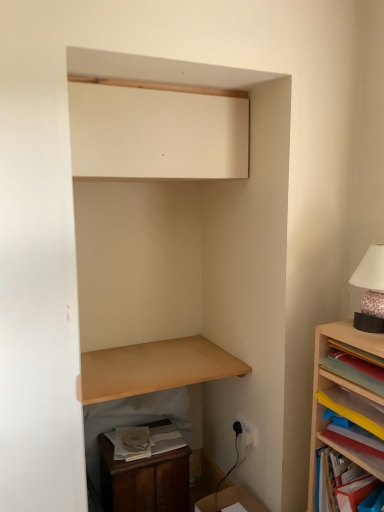
Question: In the image, is cardboard box at lower right positioned in front of or behind wooden dresser at lower left?

Choices:
 (A) front
 (B) behind

Answer: (A)

Question: Considering the positions of cardboard box at lower right and wooden dresser at lower left in the image, is cardboard box at lower right wider or thinner than wooden dresser at lower left?

Choices:
 (A) thin
 (B) wide

Answer: (A)

Question: Which of these objects is positioned farthest from the wooden dresser at lower left?

Choices:
 (A) cardboard box at lower right
 (B) wooden bookshelf at lower right, placed as the second shelf when sorted from left to right
 (C) matte pink lampshade at upper right
 (D) light brown wood shelf at lower center, which ranks as the third shelf in right-to-left order
 (E) yellow paper at upper right, placed as the 1th book when sorted from bottom to top

Answer: (C)

Question: Which of these objects is positioned farthest from the wooden bookshelf at lower right, the 2th shelf when ordered from right to left?

Choices:
 (A) yellow paper at upper right, acting as the second book starting from the top
 (B) white plastic electric outlet at lower right
 (C) wooden shelf at right, acting as the 1th shelf starting from the right
 (D) matte white cabinet at upper center
 (E) matte pink lampshade at upper right

Answer: (D)